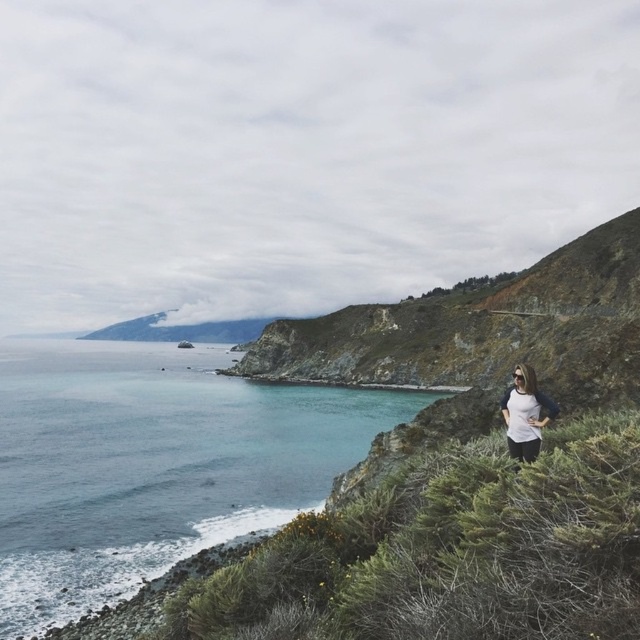
You are a photographer positioned at the cliff edge where the person is standing. You want to capture a wide shot of the blue water at lower left. Based on the coordinates provided, where should you aim your camera relative to the cliff edge?

The blue water at lower left is located at coordinates (152,464) in 2D space, so you should aim your camera slightly to the right and downward from the cliff edge to capture it.

You are a photographer planning to capture a wide shot of the coastal landscape. The blue water at lower left and the white matte shirt at center are both in your frame. Which object will occupy more space in your photo?

The blue water at lower left occupies more space in the photo because it is larger in size than the white matte shirt at center.

You are a photographer planning to take a picture of the blue water at lower left and the white matte shirt at center. Which object appears taller in the photo?

The blue water at lower left appears taller than the white matte shirt at center in the photo.